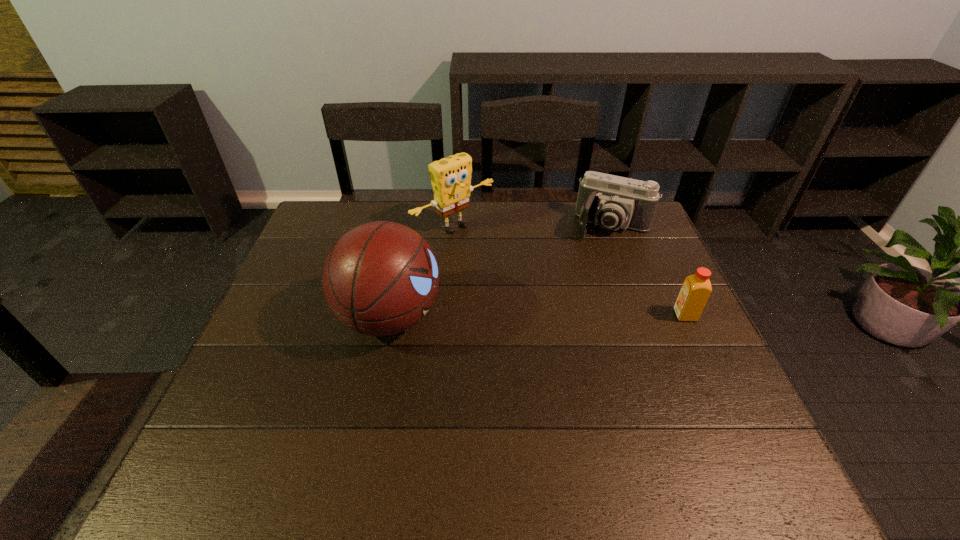
I want to click on vacant space on the desktop that is between the basketball and the orange juice and is positioned on the face of the sponge, so click(567, 316).

The image size is (960, 540). I want to click on free space on the desktop that is between the basketball and the orange juice and is positioned at the front of the camera with an open lens cover, so click(578, 316).